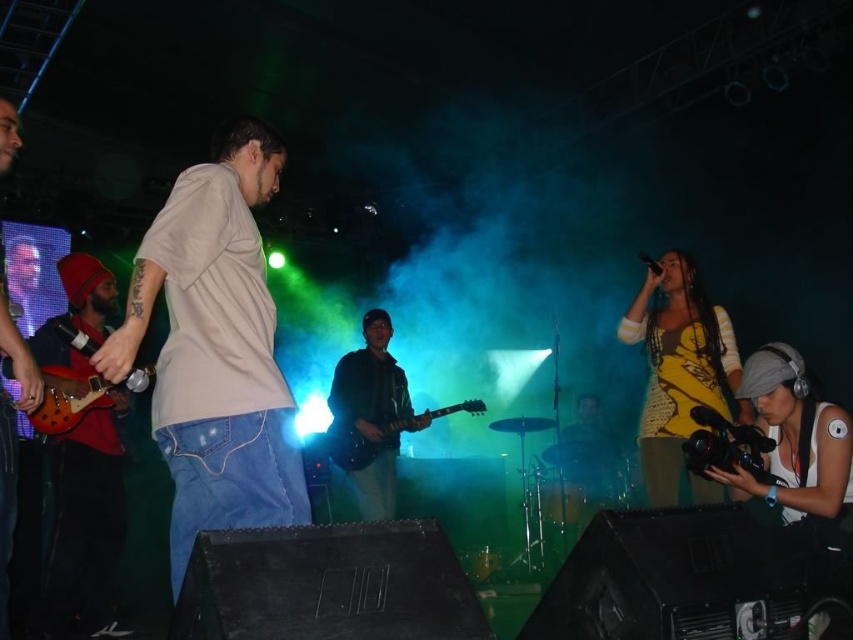
Question: Is yellow crochet top at center thinner than shiny wood electric guitar at left?

Choices:
 (A) no
 (B) yes

Answer: (B)

Question: Which point is closer to the camera?

Choices:
 (A) (381, 404)
 (B) (427, 413)
 (C) (88, 301)
 (D) (796, 502)

Answer: (D)

Question: Considering the real-world distances, which object is farthest from the shiny red guitar at left?

Choices:
 (A) shiny wood electric guitar at left
 (B) white matte shirt at center
 (C) yellow crochet top at center
 (D) shiny black guitar at center

Answer: (C)

Question: Does shiny red guitar at left appear on the left side of yellow crochet top at center?

Choices:
 (A) yes
 (B) no

Answer: (A)

Question: Can you confirm if white matte shirt at center is thinner than glossy electric guitar at center?

Choices:
 (A) no
 (B) yes

Answer: (B)

Question: Which object is the closest to the glossy electric guitar at center?

Choices:
 (A) shiny black guitar at center
 (B) white matte shirt at center
 (C) yellow crochet top at center

Answer: (A)